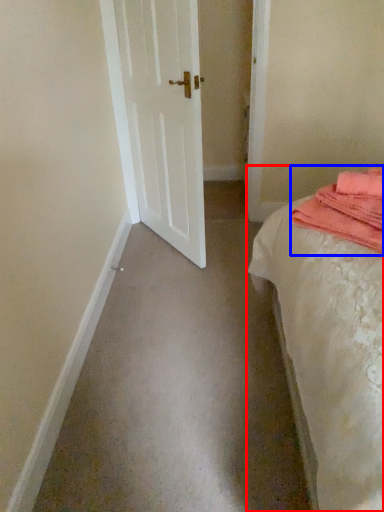
Question: Which of the following is the farthest to the observer, bed (highlighted by a red box) or material (highlighted by a blue box)?

Choices:
 (A) bed
 (B) material

Answer: (B)